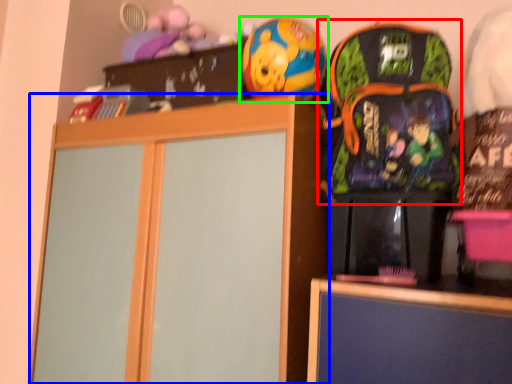
Question: Which object is positioned farthest from backpack (highlighted by a red box)? Select from cabinetry (highlighted by a blue box) and toy (highlighted by a green box).

Choices:
 (A) cabinetry
 (B) toy

Answer: (A)